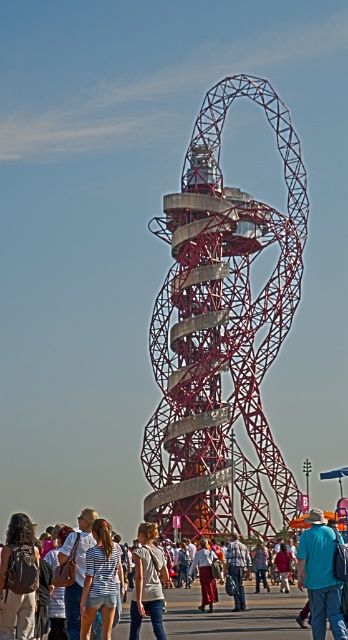
You are standing at the base of the red geometric sculpture and see the dark brown backpack at lower left and the light gray cotton shirt at lower center. Which object is positioned higher from the ground?

The dark brown backpack at lower left is above the light gray cotton shirt at lower center, so it is positioned higher from the ground.

Looking at this image, you are a photographer trying to capture a photo of the red geometric sculpture. You notice the dark brown backpack at lower left and the light gray cotton shirt at lower center are blocking your view. Which object is taller and might be obstructing your shot more?

The dark brown backpack at lower left has a greater height compared to the light gray cotton shirt at lower center, so it is taller and might be obstructing your shot more.